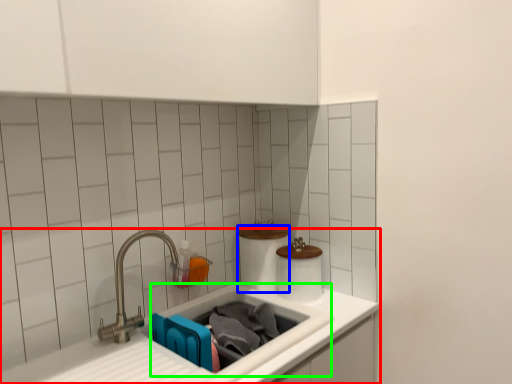
Question: Based on their relative distances, which object is farther from sink (highlighted by a red box)? Choose from toilet paper (highlighted by a blue box) and sink (highlighted by a green box).

Choices:
 (A) toilet paper
 (B) sink

Answer: (A)